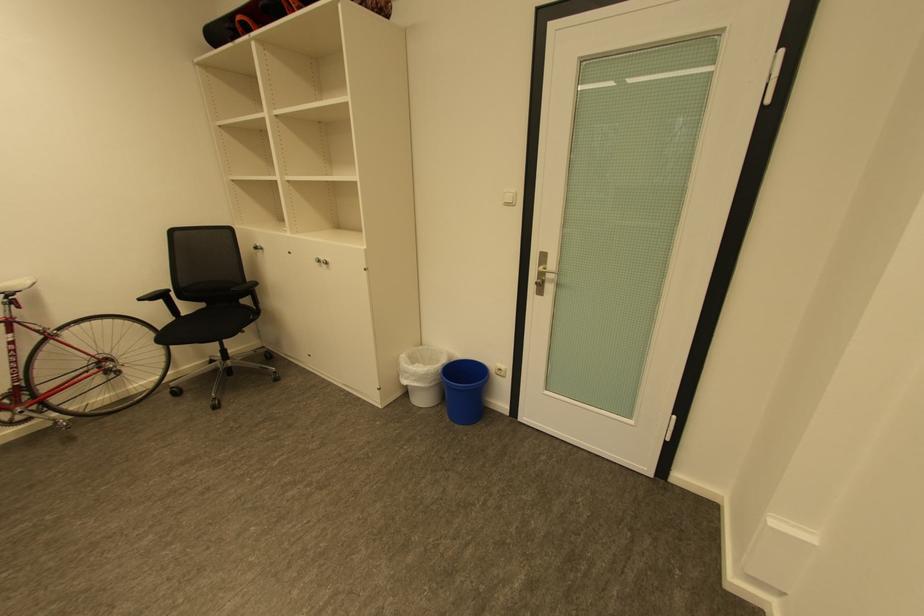
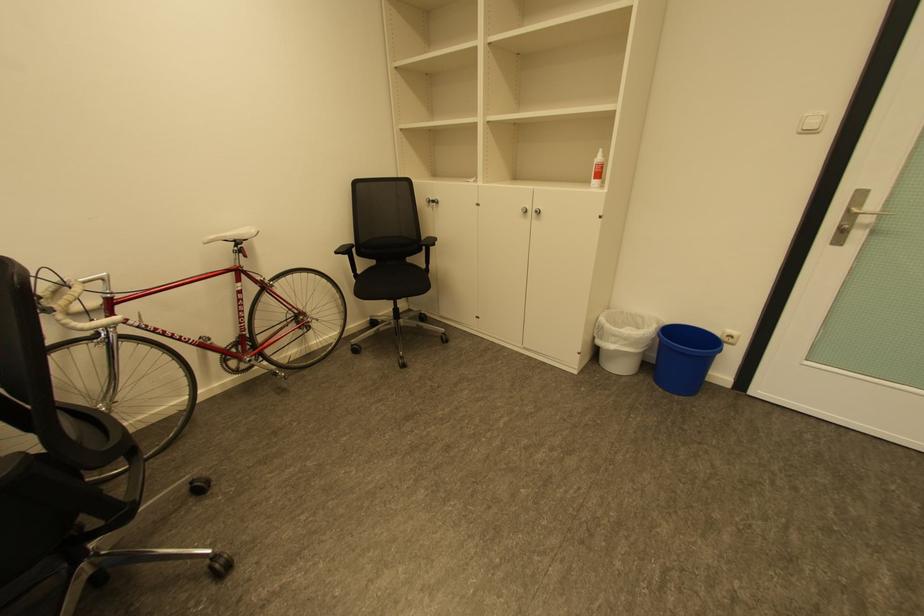
Where in the second image is the point corresponding to [456,419] from the first image?

(667, 390)